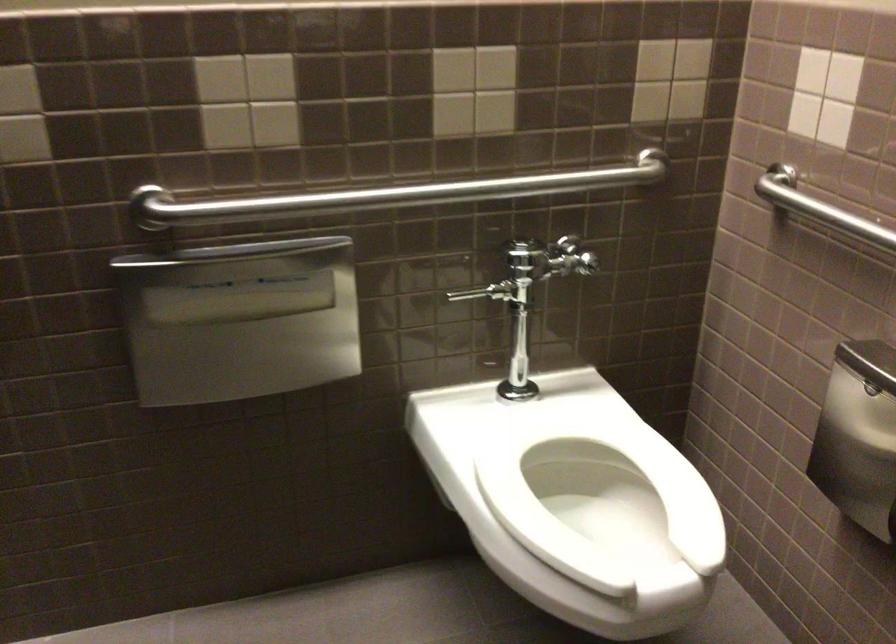
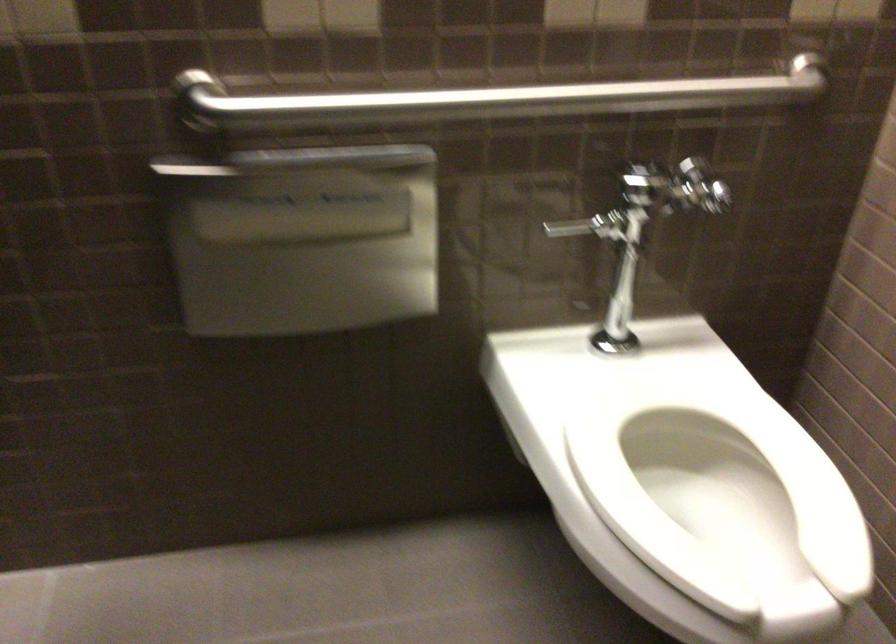
Locate, in the second image, the point that corresponds to the point at 614,512 in the first image.

(719, 494)